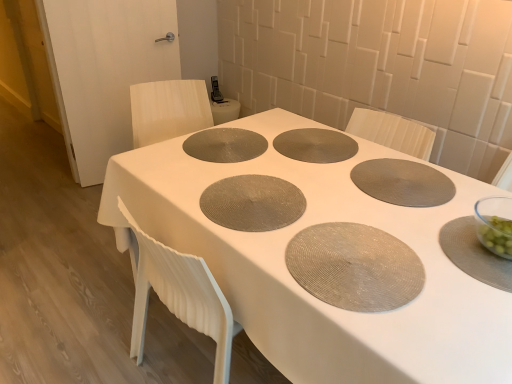
Where is `vacant space positioned to the left of matte gray placemat at center right, which ranks as the third pizza pan in left-to-right order`? This screenshot has height=384, width=512. vacant space positioned to the left of matte gray placemat at center right, which ranks as the third pizza pan in left-to-right order is located at coordinates (317, 173).